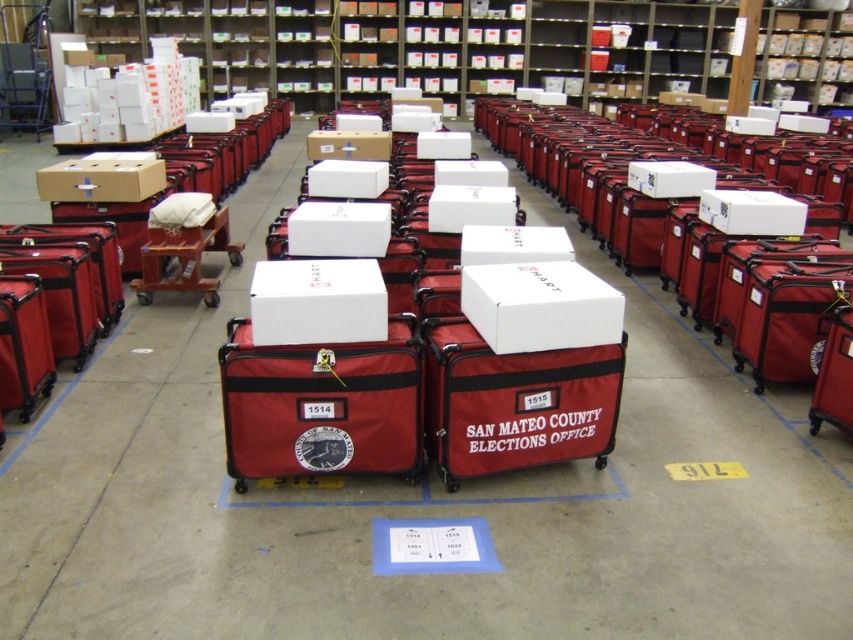
You are standing in the warehouse and need to locate two specific points marked on the floor. The first point is at coordinate point (405, 387) and the second is at point (339, 288). Which point is closer to you?

Point (339, 288) is closer to you because it is less further away than point (405, 387).

You are a warehouse worker who needs to move a box that is 2 feet wide. You see the matte cardboard box at upper left and the matte cardboard box at center. Can you fit your box between them without moving either of them?

The distance between the matte cardboard box at upper left and the matte cardboard box at center is 5.46 feet. Since your box is 2 feet wide, there is enough space between them to fit it without moving either box.

You are an employee in the warehouse and need to place a new item on the shelf. The item is wider than the red fabric rolling bag at center. Can it fit on the matte cardboard bookshelf at upper center?

The matte cardboard bookshelf at upper center is wider than the red fabric rolling bag at center. Since the item is wider than the red fabric rolling bag at center, it can fit on the matte cardboard bookshelf at upper center as long as its width does not exceed the bookshelf.